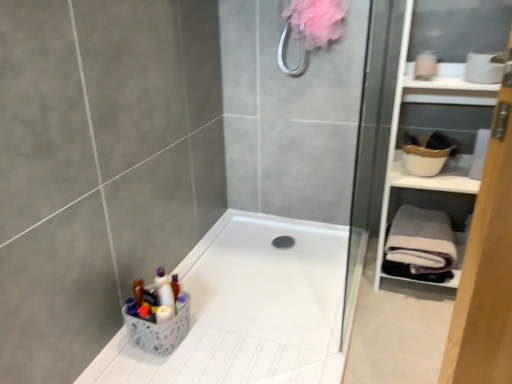
Question: From their relative heights in the image, would you say white plastic basket at lower left is taller or shorter than white plastic bathtub at lower left?

Choices:
 (A) short
 (B) tall

Answer: (B)

Question: Looking at their shapes, would you say white plastic basket at lower left is wider or thinner than white plastic bathtub at lower left?

Choices:
 (A) wide
 (B) thin

Answer: (B)

Question: Estimate the real-world distances between objects in this image. Which object is farther from the white plastic bathtub at lower left?

Choices:
 (A) white plastic basket at lower left
 (B) white matte cabinet at right
 (C) gray fleece bath towel at right

Answer: (B)

Question: Which object is the farthest from the white plastic basket at lower left?

Choices:
 (A) white plastic bathtub at lower left
 (B) gray fleece bath towel at right
 (C) white matte cabinet at right

Answer: (C)